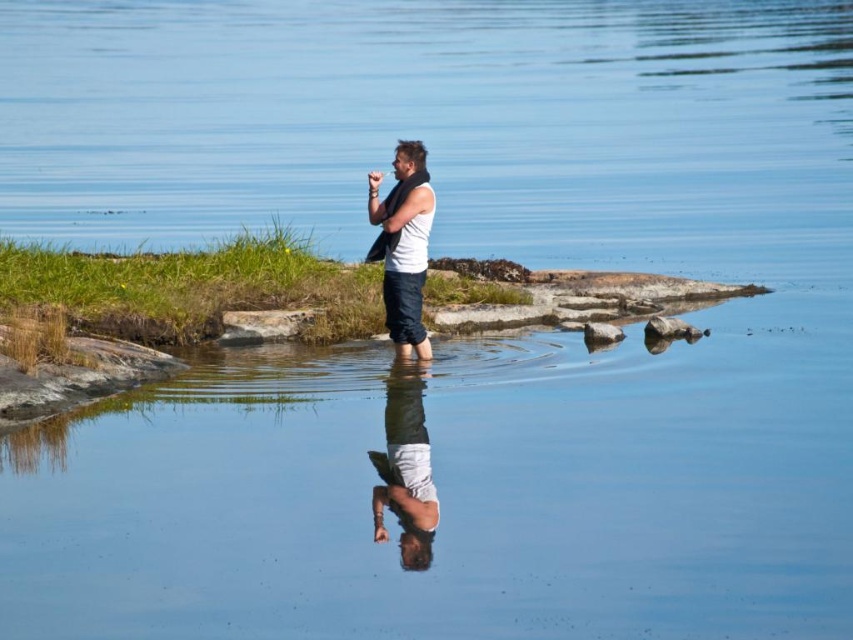
Question: Which of the following is the closest to the observer?

Choices:
 (A) smooth gray rock at center
 (B) white matte shirt at center
 (C) white matte tank top at center

Answer: (B)

Question: Is white matte tank top at center above smooth gray rock at center?

Choices:
 (A) yes
 (B) no

Answer: (A)

Question: Is white matte shirt at center above smooth gray rock at center-right?

Choices:
 (A) no
 (B) yes

Answer: (A)

Question: Does white matte tank top at center appear on the left side of smooth gray rock at center?

Choices:
 (A) yes
 (B) no

Answer: (A)

Question: Considering the real-world distances, which object is farthest from the white matte shirt at center?

Choices:
 (A) smooth gray rock at center
 (B) smooth gray rock at center-right

Answer: (B)

Question: Which point appears closest to the camera in this image?

Choices:
 (A) (595, 330)
 (B) (416, 438)
 (C) (693, 332)
 (D) (398, 353)

Answer: (B)